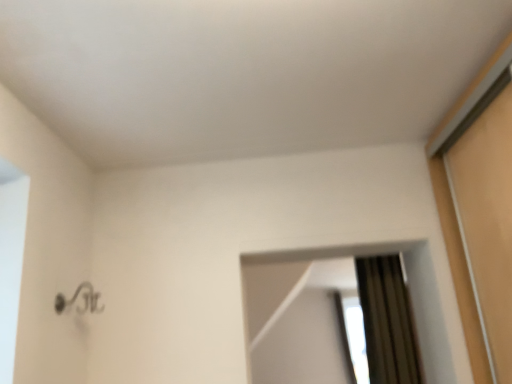
Question: Considering the positions of matte brown mirror at right and transparent glass window at upper right in the image, is matte brown mirror at right bigger or smaller than transparent glass window at upper right?

Choices:
 (A) big
 (B) small

Answer: (B)

Question: Does point (304, 307) appear closer or farther from the camera than point (344, 350)?

Choices:
 (A) closer
 (B) farther

Answer: (A)

Question: From a real-world perspective, relative to transparent glass window at upper right, is matte brown mirror at right vertically above or below?

Choices:
 (A) below
 (B) above

Answer: (B)

Question: In terms of height, does transparent glass window at upper right look taller or shorter compared to matte brown mirror at right?

Choices:
 (A) short
 (B) tall

Answer: (B)

Question: Considering the positions of point (355, 324) and point (276, 251), is point (355, 324) closer or farther from the camera than point (276, 251)?

Choices:
 (A) closer
 (B) farther

Answer: (B)

Question: Based on their sizes in the image, would you say transparent glass window at upper right is bigger or smaller than matte brown mirror at right?

Choices:
 (A) small
 (B) big

Answer: (B)

Question: Is transparent glass window at upper right wider or thinner than matte brown mirror at right?

Choices:
 (A) wide
 (B) thin

Answer: (A)